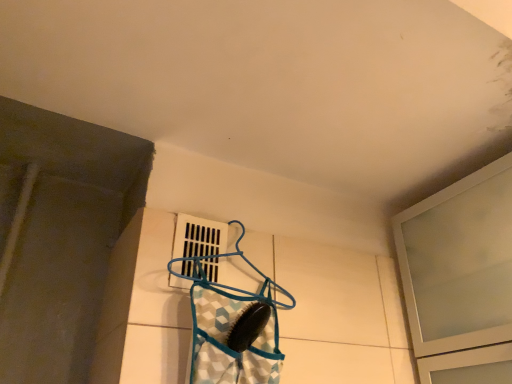
Question: Does white plastic vent at center, which is the 2th window in right-to-left order, appear on the left side of frosted glass cabinet at upper right, the second window when ordered from left to right?

Choices:
 (A) no
 (B) yes

Answer: (B)

Question: From the image's perspective, is white plastic vent at center, the 1th window viewed from the left, under frosted glass cabinet at upper right, the second window when ordered from left to right?

Choices:
 (A) yes
 (B) no

Answer: (B)

Question: Is frosted glass cabinet at upper right, the first window viewed from the right, inside white plastic vent at center, the 1th window viewed from the left?

Choices:
 (A) no
 (B) yes

Answer: (A)

Question: Does white plastic vent at center, which is the 2th window in right-to-left order, have a greater height compared to frosted glass cabinet at upper right, the second window when ordered from left to right?

Choices:
 (A) no
 (B) yes

Answer: (A)

Question: From a real-world perspective, is white plastic vent at center, which is the 2th window in right-to-left order, positioned over frosted glass cabinet at upper right, the first window viewed from the right, based on gravity?

Choices:
 (A) no
 (B) yes

Answer: (B)

Question: Could you tell me if white plastic vent at center, the 1th window viewed from the left, is facing frosted glass cabinet at upper right, the second window when ordered from left to right?

Choices:
 (A) no
 (B) yes

Answer: (A)

Question: Is blue plastic hanger at center aimed at frosted glass cabinet at upper right, the first window viewed from the right?

Choices:
 (A) no
 (B) yes

Answer: (A)

Question: Does blue plastic hanger at center have a lesser height compared to frosted glass cabinet at upper right, the first window viewed from the right?

Choices:
 (A) yes
 (B) no

Answer: (A)

Question: From the image's perspective, is blue plastic hanger at center under frosted glass cabinet at upper right, the first window viewed from the right?

Choices:
 (A) no
 (B) yes

Answer: (A)

Question: Does blue plastic hanger at center have a greater width compared to frosted glass cabinet at upper right, the first window viewed from the right?

Choices:
 (A) no
 (B) yes

Answer: (A)

Question: Is blue plastic hanger at center at the left side of frosted glass cabinet at upper right, the second window when ordered from left to right?

Choices:
 (A) no
 (B) yes

Answer: (B)

Question: Does blue plastic hanger at center come behind frosted glass cabinet at upper right, the first window viewed from the right?

Choices:
 (A) no
 (B) yes

Answer: (B)

Question: Considering the relative positions of white plastic vent at center, the 1th window viewed from the left, and blue fabric bag at center in the image provided, is white plastic vent at center, the 1th window viewed from the left, to the left of blue fabric bag at center from the viewer's perspective?

Choices:
 (A) yes
 (B) no

Answer: (A)